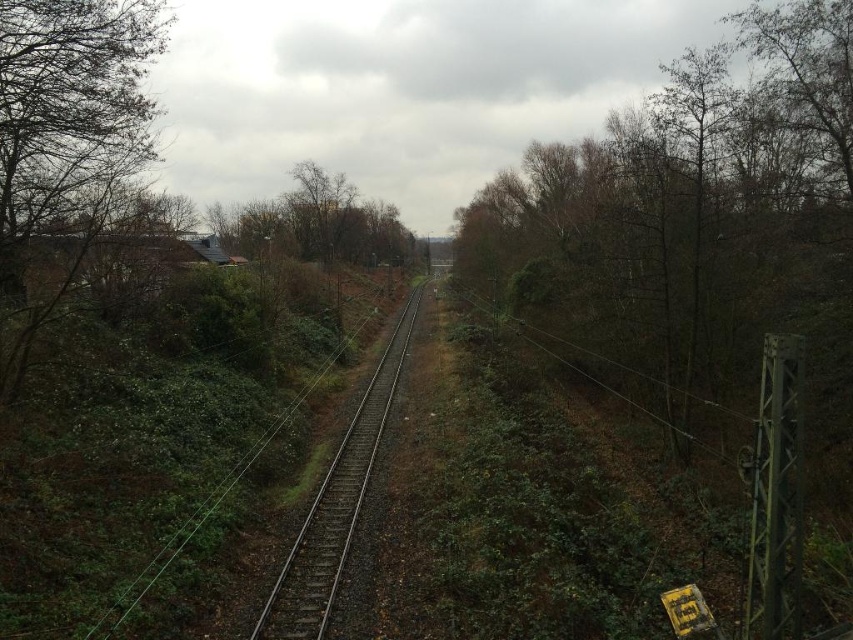
From the picture: You are a maintenance worker inspecting the brown leafy tree at right and the metal train track at center. Which object is positioned higher relative to the other?

The brown leafy tree at right is above the metal train track at center, so it is positioned higher.

You are a hiker standing between the brown leafy tree at right and the green leafy tree at left. Which tree has a wider spread of branches?

The brown leafy tree at right has a wider spread of branches than the green leafy tree at left.